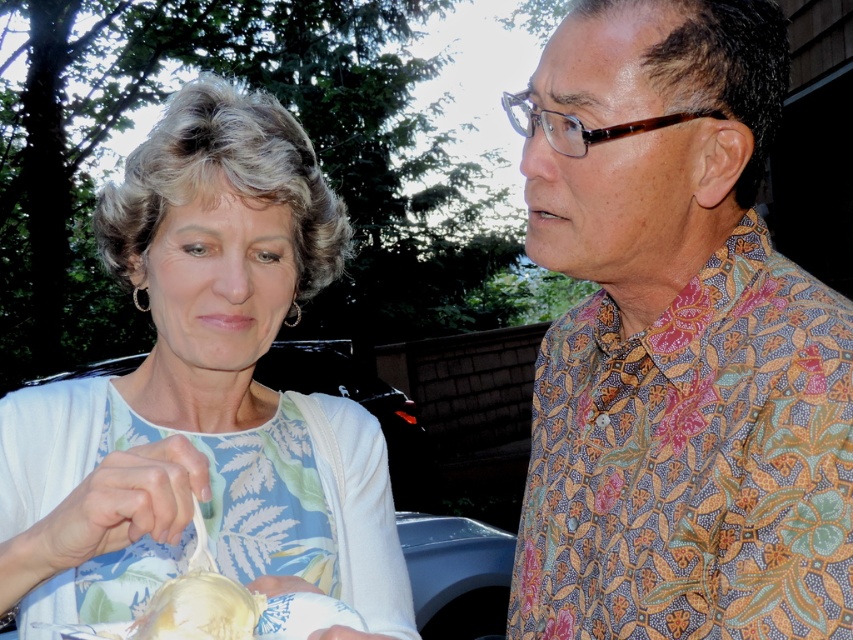
Can you confirm if floral-patterned shirt at right is shorter than white floral dress at center?

Yes, floral-patterned shirt at right is shorter than white floral dress at center.

Who is more distant from viewer, [723,634] or [132,448]?

Point [723,634]

Between point (730, 99) and point (296, 129), which one is positioned in front?

Point (730, 99) is more forward.

What are the coordinates of `floral-patterned shirt at right` in the screenshot? It's located at (676, 344).

Can you confirm if white floral dress at center is smaller than white glossy bowl at lower left?

Actually, white floral dress at center might be larger than white glossy bowl at lower left.

Consider the image. Between white floral dress at center and white glossy bowl at lower left, which one is positioned lower?

white glossy bowl at lower left

Does point (199, 122) come closer to viewer compared to point (180, 586)?

No, it is behind (180, 586).

Identify the location of white floral dress at center. This screenshot has height=640, width=853. (202, 396).

Is the position of floral-patterned shirt at right less distant than that of white glossy bowl at lower left?

No, floral-patterned shirt at right is behind white glossy bowl at lower left.

The image size is (853, 640). Identify the location of floral-patterned shirt at right. (676, 344).

Locate an element on the screen. floral-patterned shirt at right is located at coordinates (676, 344).